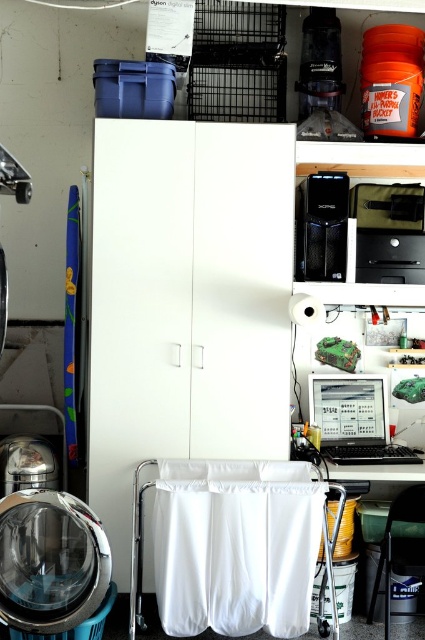
Question: Can you confirm if white fabric laundry at lower center is positioned below matte black computer at center?

Choices:
 (A) no
 (B) yes

Answer: (B)

Question: Which point is closer to the camera taking this photo?

Choices:
 (A) (42, 544)
 (B) (153, 529)
 (C) (316, 401)

Answer: (A)

Question: Can you confirm if white fabric laundry at lower center is wider than blue plastic washing machine at lower left?

Choices:
 (A) no
 (B) yes

Answer: (B)

Question: Where is white fabric laundry at lower center located in relation to blue plastic washing machine at lower left in the image?

Choices:
 (A) below
 (B) above

Answer: (A)

Question: Which point appears farthest from the camera in this image?

Choices:
 (A) (93, 596)
 (B) (354, 380)
 (C) (244, 508)

Answer: (B)

Question: Which of these objects is positioned farthest from the matte black computer at center?

Choices:
 (A) blue plastic washing machine at lower left
 (B) white fabric laundry at lower center

Answer: (A)